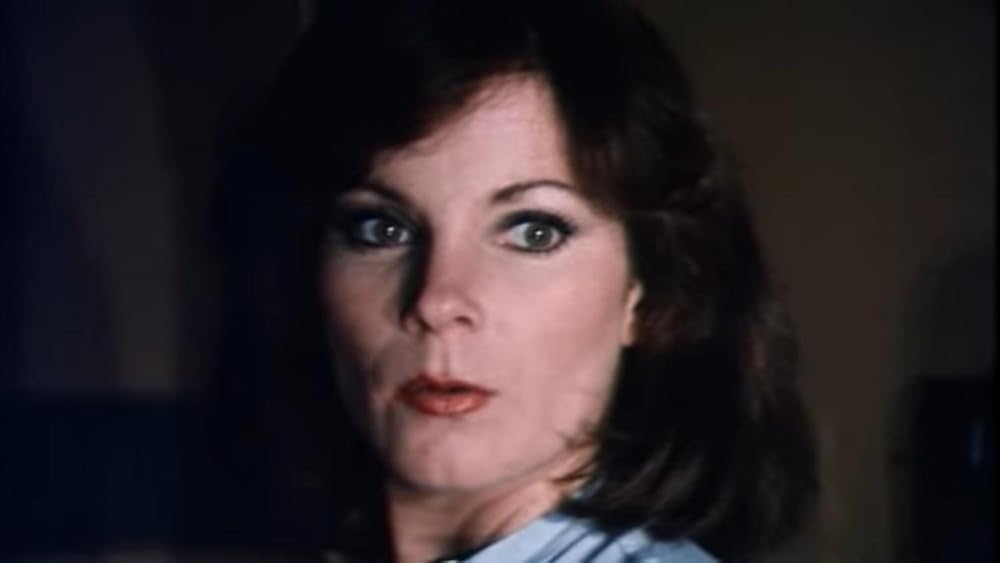
What are the coordinates of `wall` in the screenshot? It's located at (111, 154), (837, 149).